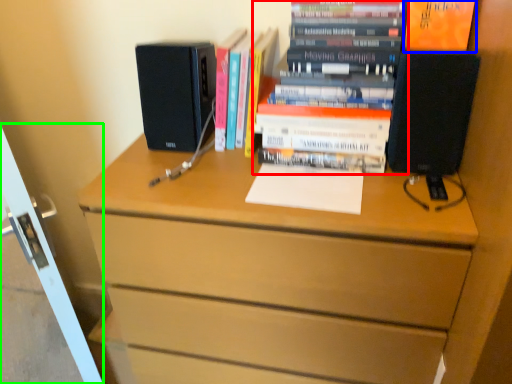
Question: Which is nearer to the book (highlighted by a red box)? paperback book (highlighted by a blue box) or screen door (highlighted by a green box).

Choices:
 (A) paperback book
 (B) screen door

Answer: (A)